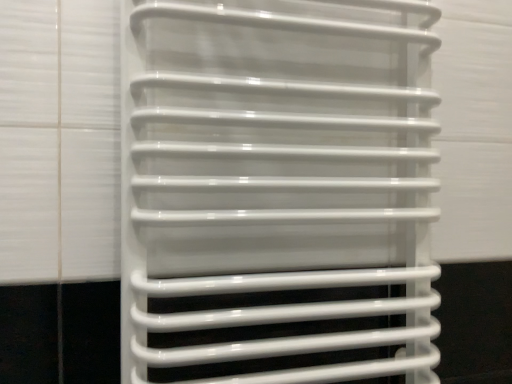
Question: Should I look upward or downward to see white glossy towel rack at center?

Choices:
 (A) down
 (B) up

Answer: (A)